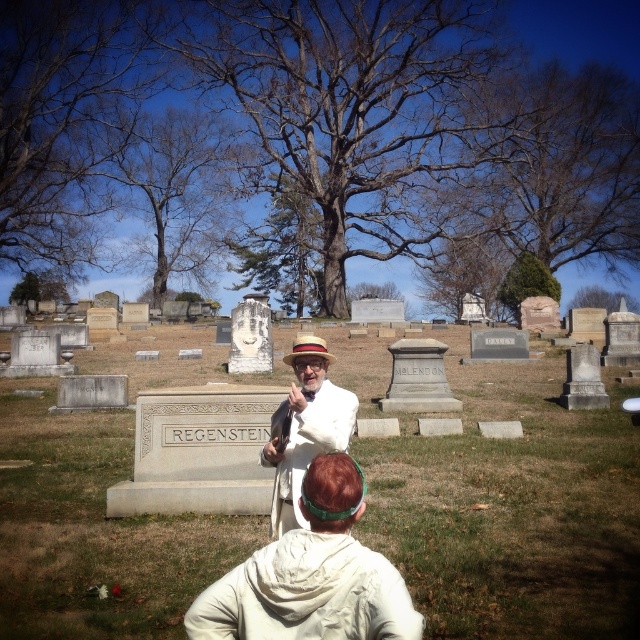
You are a photographer trying to capture a portrait of both the white cotton hoodie at center and the brown straw cowboy hat at center in the cemetery scene. Based on their positions, which object should you focus on first to ensure both are in frame?

The white cotton hoodie at center is located below the brown straw cowboy hat at center, so you should focus on the brown straw cowboy hat at center first to ensure both are in frame.

In the scene shown: You are standing in the cemetery and want to hand a flower to the person wearing the white cotton hoodie at center and the brown straw cowboy hat at center. Which one should you approach first to ensure you can reach them without moving past the other?

You should approach the white cotton hoodie at center first because it is closer to you than the brown straw cowboy hat at center, so you can reach them without needing to move past the other person.

You are a tour guide leading a group through the cemetery. You notice the gray stone gravestone at center and the white cotton hoodie at center. Which object is taller?

The gray stone gravestone at center is taller than the white cotton hoodie at center.